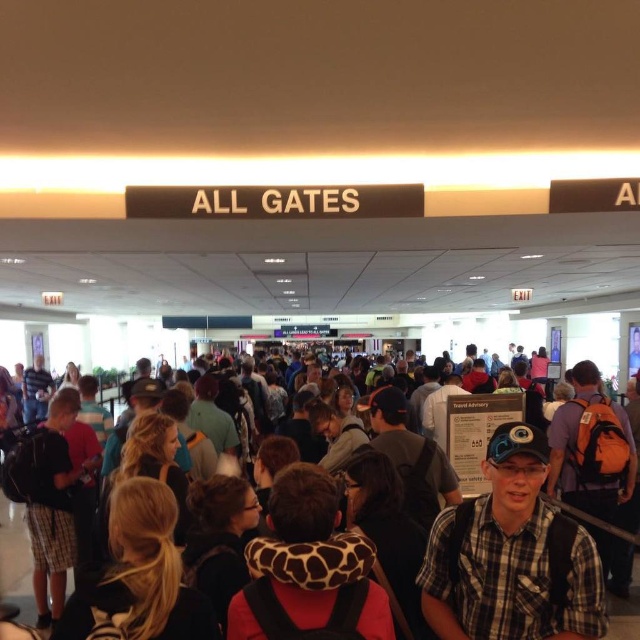
You are a traveler trying to navigate through the crowd in the airport terminal. You notice a person wearing plaid shorts at left and another carrying multicolored backpacks at center. Which item takes up more horizontal space in the scene?

The multicolored backpacks at center take up more horizontal space because the plaid shorts at left has a lesser width compared to multicolored backpacks at center.